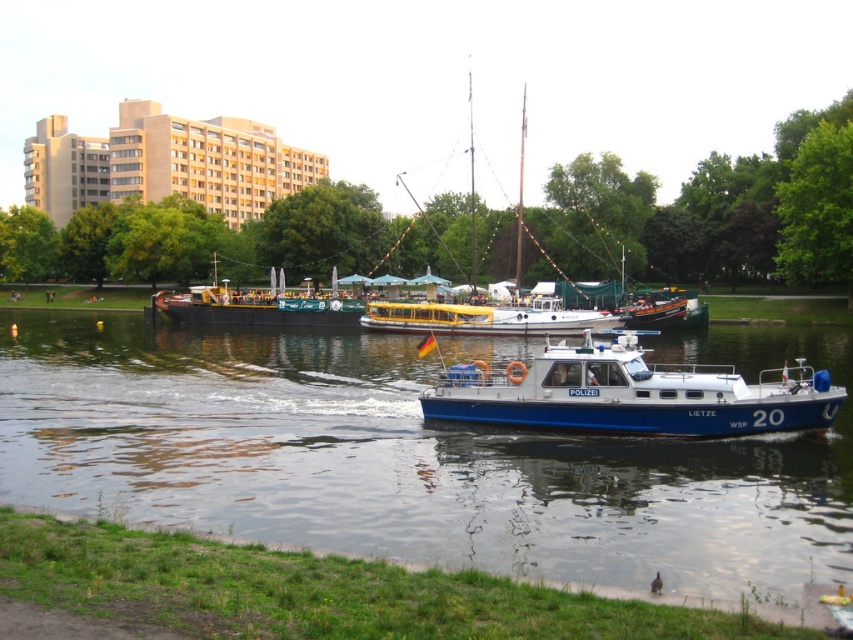
Is blue metallic boat at center further to the viewer compared to green canvas barge at center?

No, blue metallic boat at center is in front of green canvas barge at center.

I want to click on blue metallic boat at center, so click(413, 458).

In order to click on blue metallic boat at center in this screenshot , I will do `click(413, 458)`.

Is blue metallic boat at center bigger than blue metallic police boat at center?

Yes.

Locate an element on the screen. blue metallic boat at center is located at coordinates (413, 458).

Based on the photo, is blue metallic boat at center below yellow matte boat at center?

Indeed, blue metallic boat at center is positioned under yellow matte boat at center.

This screenshot has width=853, height=640. What are the coordinates of `blue metallic boat at center` in the screenshot? It's located at (413, 458).

Which is behind, point (236, 358) or point (506, 317)?

The point (506, 317) is more distant.

The width and height of the screenshot is (853, 640). I want to click on blue metallic boat at center, so click(413, 458).